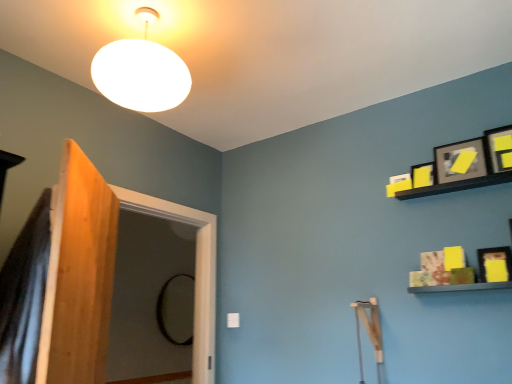
Question: Considering their positions, is yellow matte picture frame at upper right, which ranks as the 2th picture frame in bottom-to-top order, located in front of or behind black glass mirror at center?

Choices:
 (A) behind
 (B) front

Answer: (B)

Question: Is yellow matte picture frame at upper right, which ranks as the 2th picture frame in bottom-to-top order, taller or shorter than black glass mirror at center?

Choices:
 (A) short
 (B) tall

Answer: (A)

Question: Which object is the farthest from the black glass mirror at center?

Choices:
 (A) white matte lampshade at upper center
 (B) yellow matte picture frame at upper right, positioned as the third picture frame in top-to-bottom order
 (C) matte black picture frame at upper right, the third picture frame in the bottom-to-top sequence
 (D) matte black picture frame at upper right, placed as the 4th picture frame when sorted from bottom to top
 (E) matte black picture frame at upper right, positioned as the 4th picture frame in top-to-bottom order

Answer: (D)

Question: Which object is the farthest from the black glass mirror at center?

Choices:
 (A) wooden screen door at left
 (B) white matte lampshade at upper center
 (C) matte black picture frame at upper right, the third picture frame in the bottom-to-top sequence
 (D) matte black picture frame at upper right, which is counted as the 1th picture frame, starting from the top
 (E) yellow matte picture frame at upper right, which ranks as the 2th picture frame in bottom-to-top order

Answer: (D)